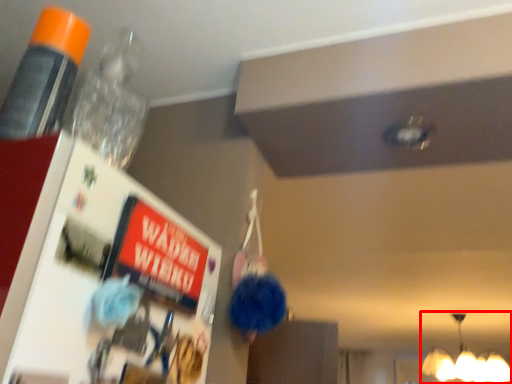
Question: From the image's perspective, what is the correct spatial relationship of lamp (annotated by the red box) in relation to bottle?

Choices:
 (A) below
 (B) above

Answer: (A)